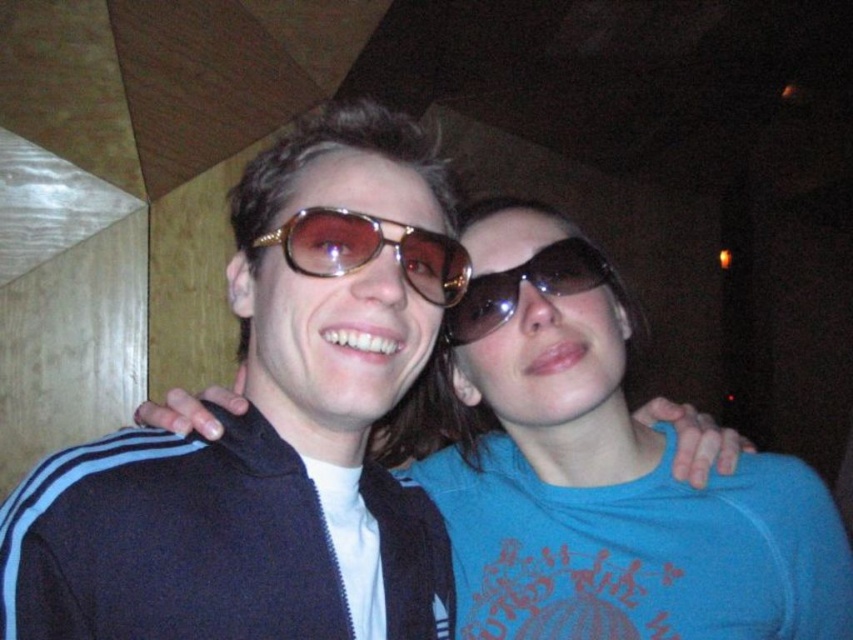
Question: Observing the image, what is the correct spatial positioning of metallic gold sunglasses at center in reference to sunglasses at center?

Choices:
 (A) left
 (B) right

Answer: (A)

Question: Among these objects, which one is nearest to the camera?

Choices:
 (A) sunglasses at center
 (B) gold metallic sunglasses at center
 (C) metallic gold sunglasses at center

Answer: (C)

Question: In this image, where is blue matte shirt at center located relative to gold metallic sunglasses at center?

Choices:
 (A) left
 (B) right

Answer: (B)

Question: Can you confirm if blue matte shirt at center is positioned above sunglasses at center?

Choices:
 (A) yes
 (B) no

Answer: (B)

Question: Which object appears farthest from the camera in this image?

Choices:
 (A) blue matte shirt at center
 (B) gold metallic sunglasses at center
 (C) metallic gold sunglasses at center
 (D) sunglasses at center

Answer: (D)

Question: Among these objects, which one is nearest to the camera?

Choices:
 (A) gold metallic sunglasses at center
 (B) metallic gold sunglasses at center
 (C) blue matte shirt at center
 (D) sunglasses at center

Answer: (B)